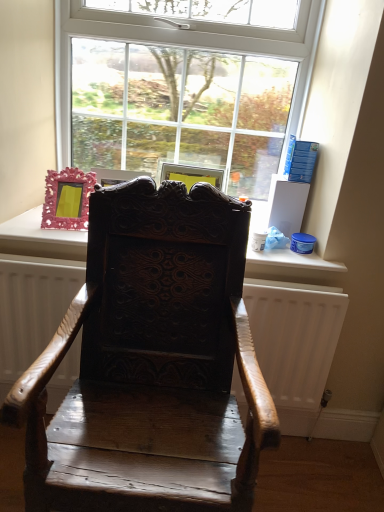
Question: Do you think wooden radiator at center is within pink plastic picture frame at upper left, or outside of it?

Choices:
 (A) inside
 (B) outside

Answer: (B)

Question: In terms of size, does wooden radiator at center appear bigger or smaller than pink plastic picture frame at upper left?

Choices:
 (A) small
 (B) big

Answer: (B)

Question: Estimate the real-world distances between objects in this image. Which object is farther from the pink plastic picture frame at upper left?

Choices:
 (A) clear glass window at upper center
 (B) dark wood carved chair at center
 (C) wooden radiator at center

Answer: (C)

Question: Which is farther from the dark wood carved chair at center?

Choices:
 (A) pink plastic picture frame at upper left
 (B) wooden radiator at center
 (C) clear glass window at upper center

Answer: (C)